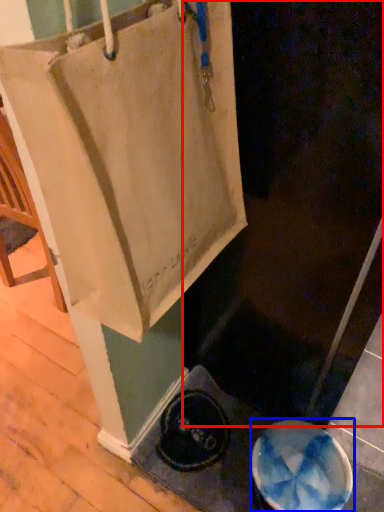
Question: Which object is further to the camera taking this photo, screen door (highlighted by a red box) or manhole cover (highlighted by a blue box)?

Choices:
 (A) screen door
 (B) manhole cover

Answer: (B)